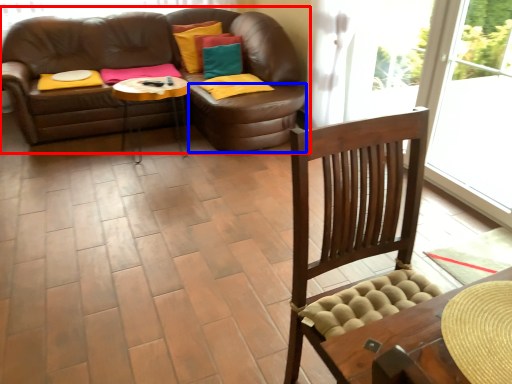
Question: Which point is further to the camera, studio couch (highlighted by a red box) or footrest (highlighted by a blue box)?

Choices:
 (A) studio couch
 (B) footrest

Answer: (A)